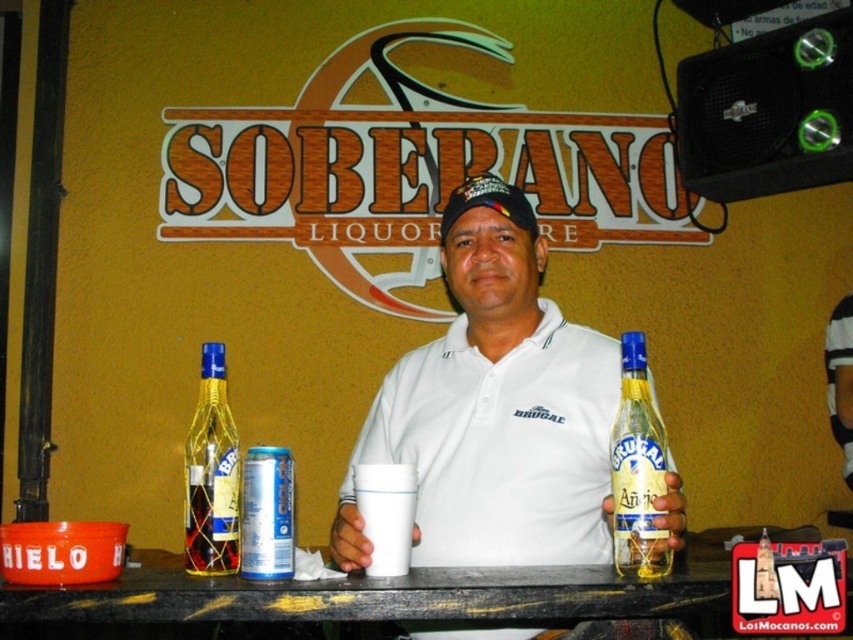
Question: Which of these objects is positioned closest to the translucent glass bottle at left?

Choices:
 (A) black matte table at center
 (B) white matte shirt at center
 (C) translucent glass bottle at center

Answer: (B)

Question: Which is farther from the white matte shirt at center?

Choices:
 (A) translucent glass bottle at left
 (B) translucent glass bottle at center
 (C) black matte table at center

Answer: (A)

Question: Is white matte shirt at center smaller than translucent glass bottle at left?

Choices:
 (A) no
 (B) yes

Answer: (A)

Question: Is translucent glass bottle at center positioned at the back of translucent glass bottle at left?

Choices:
 (A) yes
 (B) no

Answer: (B)

Question: Can you confirm if white matte shirt at center is thinner than translucent glass bottle at center?

Choices:
 (A) yes
 (B) no

Answer: (B)

Question: Which object appears farthest from the camera in this image?

Choices:
 (A) white matte shirt at center
 (B) translucent glass bottle at left

Answer: (B)